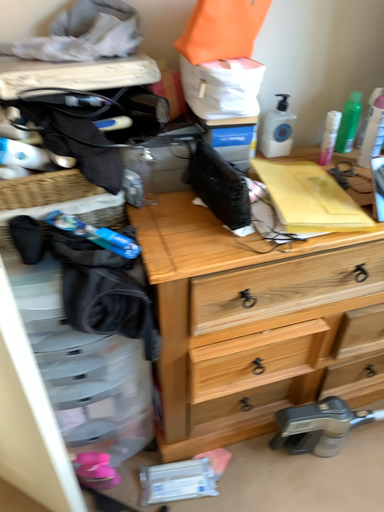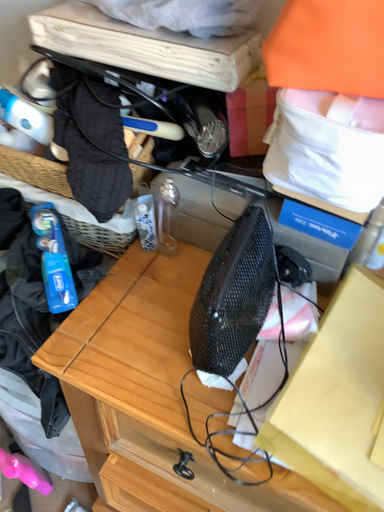
Question: Which way did the camera rotate in the video?

Choices:
 (A) rotated right
 (B) rotated left

Answer: (B)